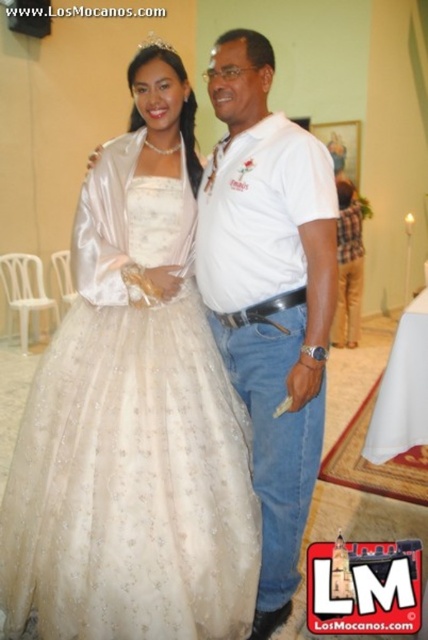
Question: Among these objects, which one is farthest from the camera?

Choices:
 (A) white cotton shirt at center
 (B) satin/embroidered dress at center

Answer: (B)

Question: Which object appears farthest from the camera in this image?

Choices:
 (A) satin/embroidered dress at center
 (B) white cotton shirt at center

Answer: (A)

Question: Can you confirm if satin/embroidered dress at center is positioned above white cotton shirt at center?

Choices:
 (A) no
 (B) yes

Answer: (A)

Question: Which of the following is the closest to the observer?

Choices:
 (A) satin/embroidered dress at center
 (B) white cotton shirt at center

Answer: (B)

Question: Can you confirm if satin/embroidered dress at center is positioned to the left of white cotton shirt at center?

Choices:
 (A) no
 (B) yes

Answer: (B)

Question: Where is satin/embroidered dress at center located in relation to white cotton shirt at center in the image?

Choices:
 (A) left
 (B) right

Answer: (A)